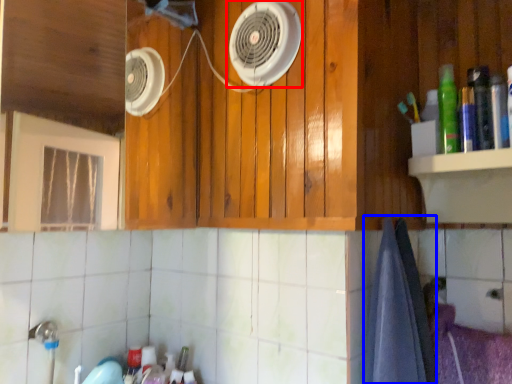
Question: Which point is further to the camera, home appliance (highlighted by a red box) or bath towel (highlighted by a blue box)?

Choices:
 (A) home appliance
 (B) bath towel

Answer: (A)